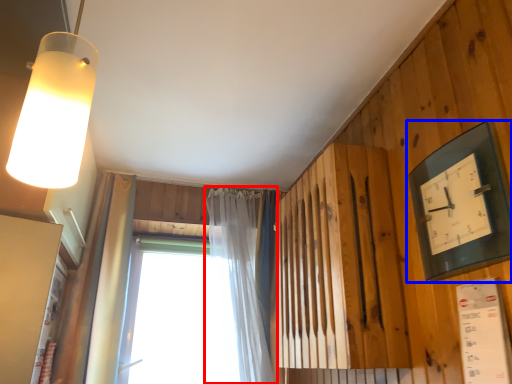
Question: Which object is closer to the camera taking this photo, curtain (highlighted by a red box) or clock (highlighted by a blue box)?

Choices:
 (A) curtain
 (B) clock

Answer: (B)